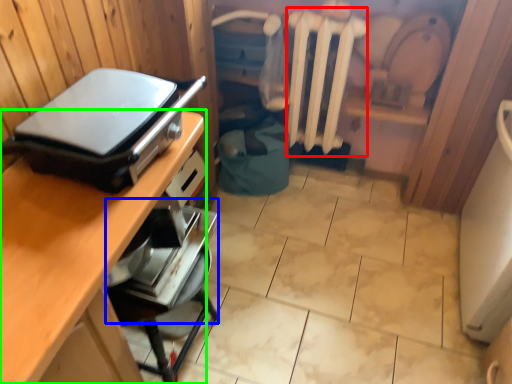
Question: Which is nearer to the radiator (highlighted by a red box)? appliance (highlighted by a blue box) or desk (highlighted by a green box).

Choices:
 (A) appliance
 (B) desk

Answer: (A)